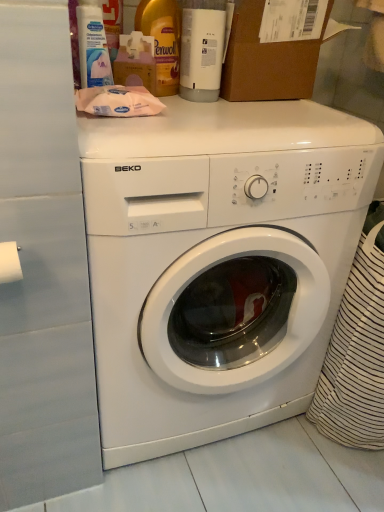
Identify the location of vacant area located to the right-hand side of white plastic bottle at upper center, acting as the second bottle starting from the left. (270, 106).